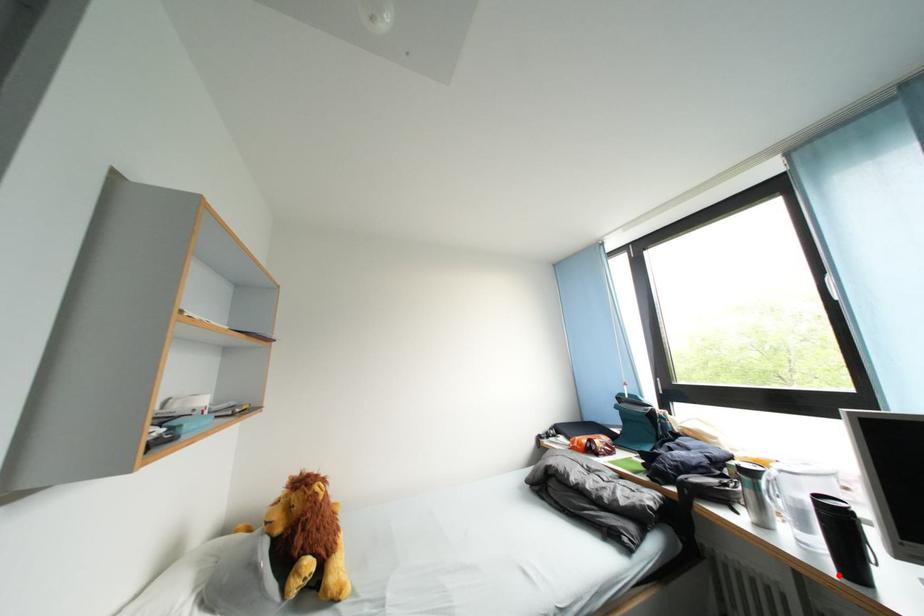
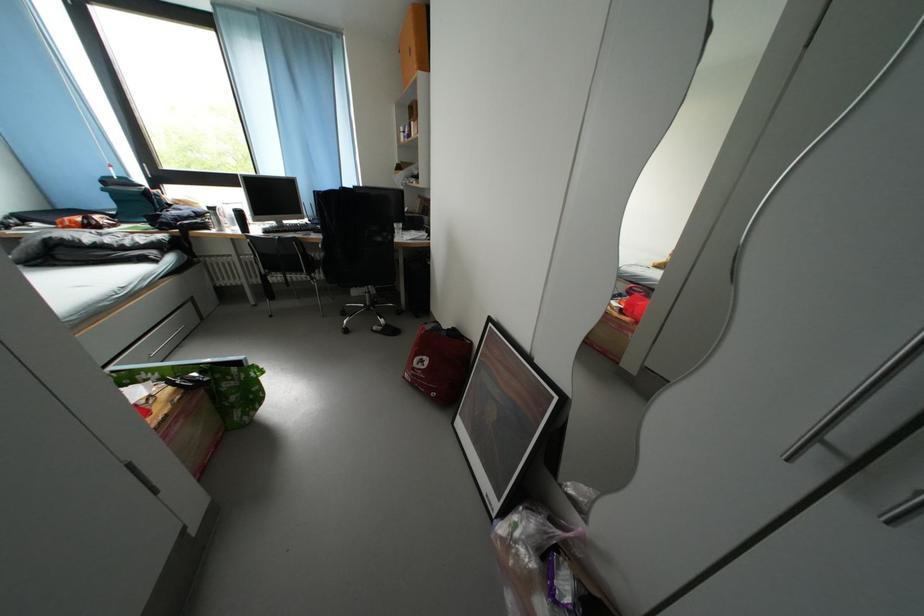
In the second image, find the point that corresponds to the highlighted location in the first image.

(248, 238)